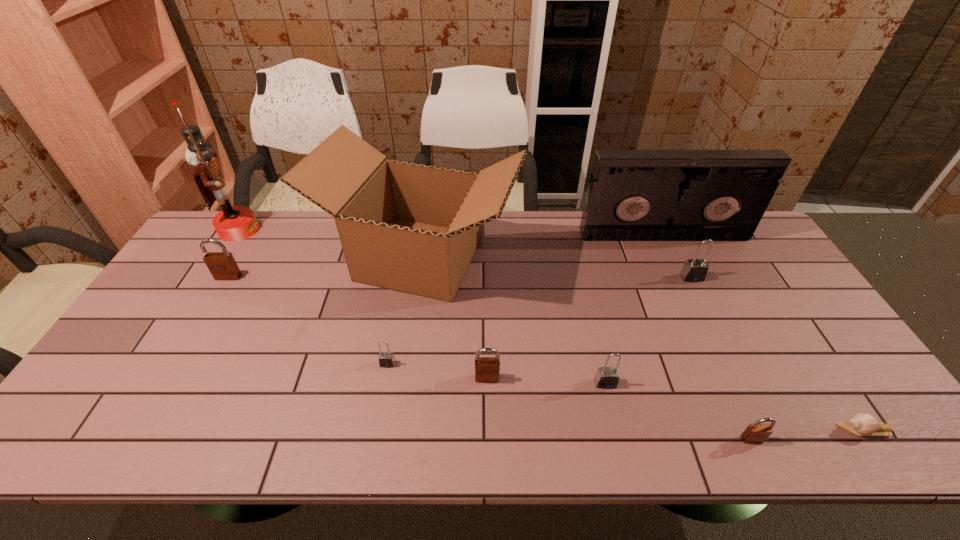
In the image, there is a desktop. Identify the location of vacant space at the near edge. This screenshot has height=540, width=960. (204, 416).

Where is `vacant space at the left edge`? The width and height of the screenshot is (960, 540). vacant space at the left edge is located at coordinates (189, 279).

You are a GUI agent. You are given a task and a screenshot of the screen. Output one action in this format:
    pyautogui.click(x=<x>, y=<y>)
    Task: Click on the vacant space at the right edge
    
    Given the screenshot: What is the action you would take?
    (x=812, y=399)

The width and height of the screenshot is (960, 540). I want to click on free region at the far right corner of the desktop, so click(756, 247).

Find the location of a particular element. This screenshot has height=540, width=960. vacant space in between the sixth object from left to right and the fourth padlock from right to left is located at coordinates (546, 381).

Locate an element on the screen. unoccupied position between the box and the fourth padlock from right to left is located at coordinates (454, 318).

The image size is (960, 540). Find the location of `vacant space that is in between the second smallest gray padlock and the leftmost padlock`. vacant space that is in between the second smallest gray padlock and the leftmost padlock is located at coordinates (417, 330).

Identify the location of vacant area that lies between the farthest brown padlock and the escargot. (547, 353).

You are a GUI agent. You are given a task and a screenshot of the screen. Output one action in this format:
    pyautogui.click(x=<x>, y=<y>)
    Task: Click on the empty space that is in between the second farthest brown padlock and the second biggest gray padlock
    
    Given the screenshot: What is the action you would take?
    pyautogui.click(x=546, y=381)

Locate an element on the screen. free space between the fourth padlock from right to left and the box is located at coordinates (454, 318).